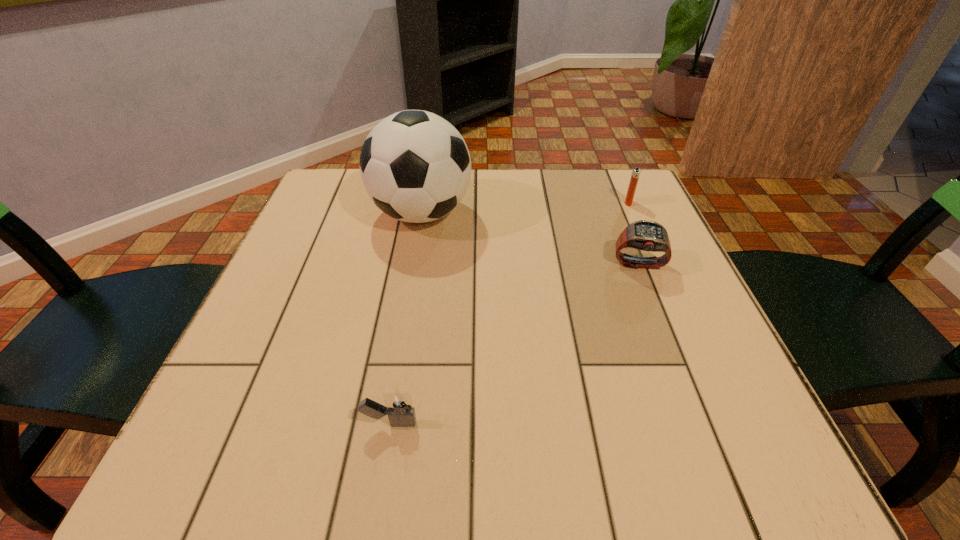
Find the location of a particular element. Image resolution: width=960 pixels, height=540 pixels. free space between the soccer ball and the farther igniter is located at coordinates (525, 208).

Locate an element on the screen. Image resolution: width=960 pixels, height=540 pixels. free space between the right igniter and the soccer ball is located at coordinates (525, 208).

Locate an element on the screen. The height and width of the screenshot is (540, 960). object that is the second closest one to the soccer ball is located at coordinates (635, 174).

Locate which object is the closest to the watch. Please provide its 2D coordinates. Your answer should be formatted as a tuple, i.e. [(x, y)], where the tuple contains the x and y coordinates of a point satisfying the conditions above.

[(635, 174)]

Locate an element on the screen. free spot that satisfies the following two spatial constraints: 1. on the front side of the soccer ball; 2. on the left side of the watch is located at coordinates (413, 265).

Where is `free space that satisfies the following two spatial constraints: 1. on the back side of the watch; 2. on the left side of the farther igniter`? This screenshot has height=540, width=960. free space that satisfies the following two spatial constraints: 1. on the back side of the watch; 2. on the left side of the farther igniter is located at coordinates (614, 202).

Locate an element on the screen. Image resolution: width=960 pixels, height=540 pixels. vacant area that satisfies the following two spatial constraints: 1. on the back side of the shorter igniter; 2. on the left side of the second nearest object is located at coordinates (416, 265).

You are a GUI agent. You are given a task and a screenshot of the screen. Output one action in this format:
    pyautogui.click(x=<x>, y=<y>)
    Task: Click on the free space that satisfies the following two spatial constraints: 1. on the back side of the watch; 2. on the right side of the right igniter
    
    Given the screenshot: What is the action you would take?
    (x=614, y=202)